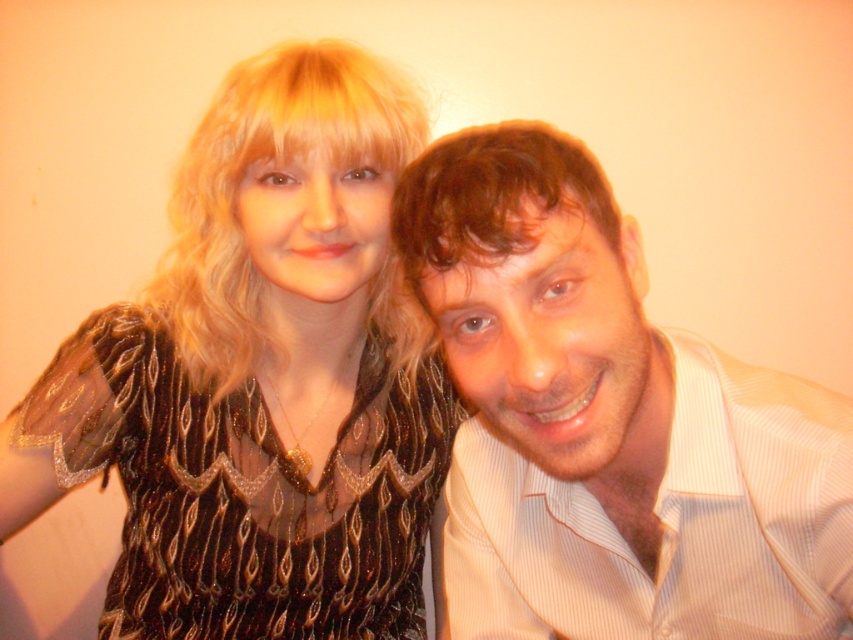
From the picture: How much distance is there between light brown striped shirt at center and black sequined dress at center?

The distance of light brown striped shirt at center from black sequined dress at center is 27.98 centimeters.

Does light brown striped shirt at center appear over black sequined dress at center?

Yes, light brown striped shirt at center is above black sequined dress at center.

Who is more distant from viewer, (x=428, y=168) or (x=56, y=397)?

The point (x=56, y=397) is behind.

Locate an element on the screen. light brown striped shirt at center is located at coordinates (608, 422).